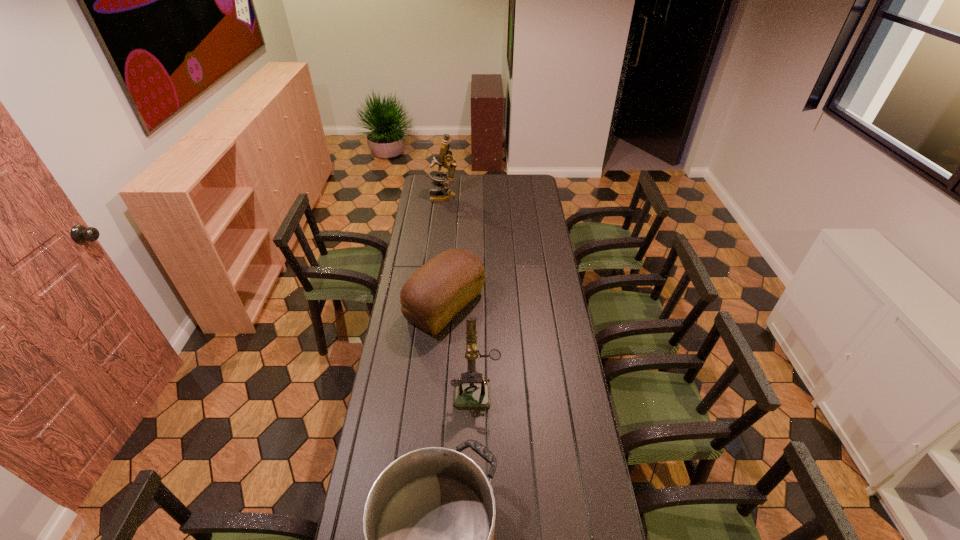
Locate an element on the screen. Image resolution: width=960 pixels, height=540 pixels. microscope that is at the left edge is located at coordinates (445, 157).

Where is `bread positioned at the left edge`? The width and height of the screenshot is (960, 540). bread positioned at the left edge is located at coordinates (436, 292).

Identify the location of object that is at the far left corner. The height and width of the screenshot is (540, 960). (445, 157).

Find the location of `vacant space at the far edge of the desktop`. vacant space at the far edge of the desktop is located at coordinates (504, 180).

What are the coordinates of `vacant space at the left edge of the desktop` in the screenshot? It's located at (412, 347).

This screenshot has width=960, height=540. In the image, there is a desktop. Find the location of `vacant region at the right edge`. vacant region at the right edge is located at coordinates (555, 268).

At what (x,y) coordinates should I click in order to perform the action: click on free spot at the far right corner of the desktop. Please return your answer as a coordinate pair (x, y). Looking at the image, I should click on (540, 178).

I want to click on blank region between the right microscope and the bread, so click(461, 348).

Identify the location of vacant region between the nearer microscope and the second shortest object. Image resolution: width=960 pixels, height=540 pixels. (461, 348).

Where is `object identified as the second closest to the left microscope`? The height and width of the screenshot is (540, 960). object identified as the second closest to the left microscope is located at coordinates (471, 395).